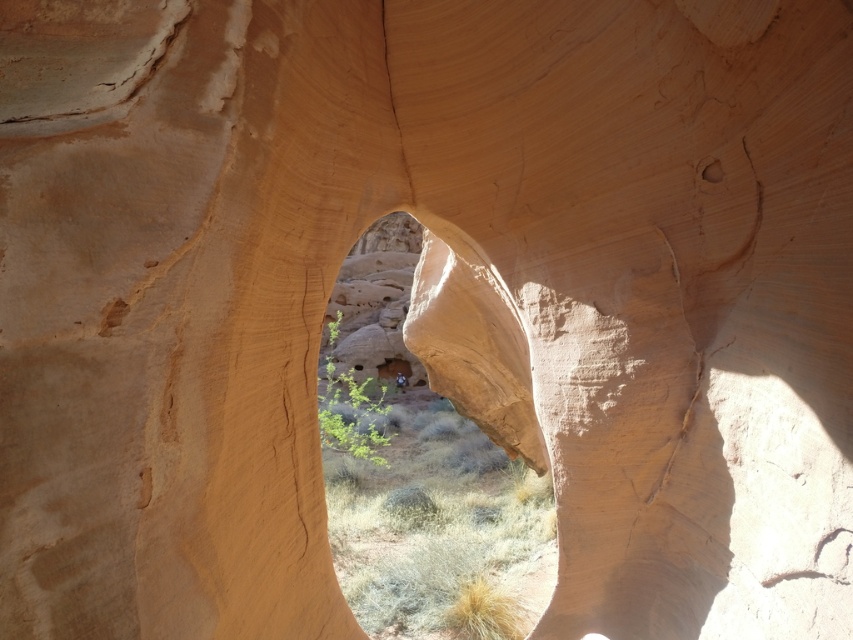
You are a hiker trying to navigate through the smooth sandstone arch at center and the smooth sandstone hole at upper center. Which direction should you go to reach the hole from the arch?

To reach the smooth sandstone hole at upper center from the smooth sandstone arch at center, you should go to the right since the arch is positioned to the left of the hole.

You are a geologist examining the rock formations. You notice the smooth sandstone arch at center and the smooth sandstone hole at upper center. Which of these two features is positioned higher up in the image?

The smooth sandstone hole at upper center is positioned higher up in the image than the smooth sandstone arch at center.